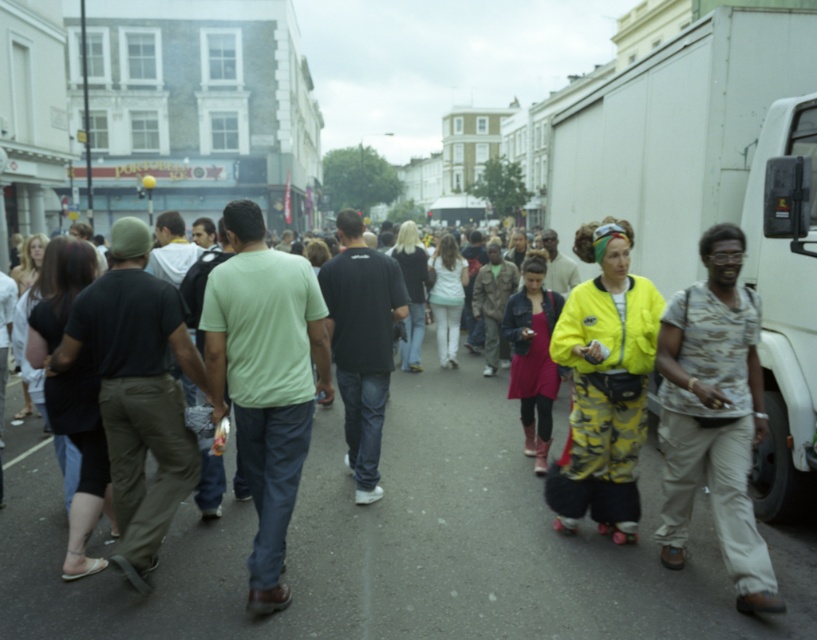
Question: Which object is closer to the camera taking this photo?

Choices:
 (A) light green cotton t-shirt at center
 (B) camouflage shirt at right
 (C) neon yellow jacket at center

Answer: (B)

Question: Can you confirm if light green cotton t-shirt at center is wider than neon yellow jacket at center?

Choices:
 (A) no
 (B) yes

Answer: (B)

Question: Is light green cotton t-shirt at center below neon yellow jacket at center?

Choices:
 (A) no
 (B) yes

Answer: (B)

Question: Is light green cotton t-shirt at center below camouflage shirt at right?

Choices:
 (A) no
 (B) yes

Answer: (B)

Question: Among these points, which one is nearest to the camera?

Choices:
 (A) (608, 528)
 (B) (572, 572)
 (C) (286, 288)
 (D) (703, 384)

Answer: (C)

Question: Among these points, which one is nearest to the camera?

Choices:
 (A) (257, 636)
 (B) (577, 452)
 (C) (257, 568)

Answer: (A)